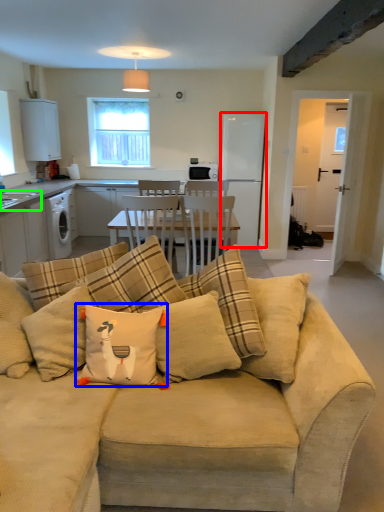
Question: Which object is the closest to the appliance (highlighted by a red box)? Choose among these: throw pillow (highlighted by a blue box) or sink (highlighted by a green box).

Choices:
 (A) throw pillow
 (B) sink

Answer: (B)